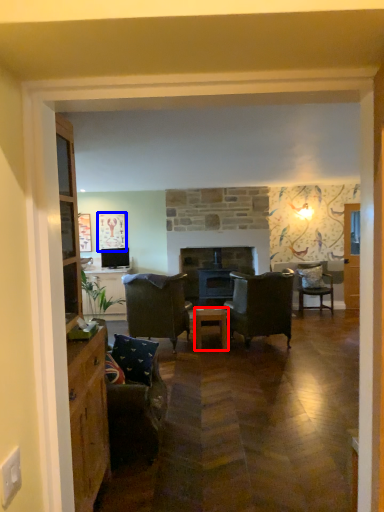
Question: Which of the following is the closest to the observer, table (highlighted by a red box) or picture frame (highlighted by a blue box)?

Choices:
 (A) table
 (B) picture frame

Answer: (A)